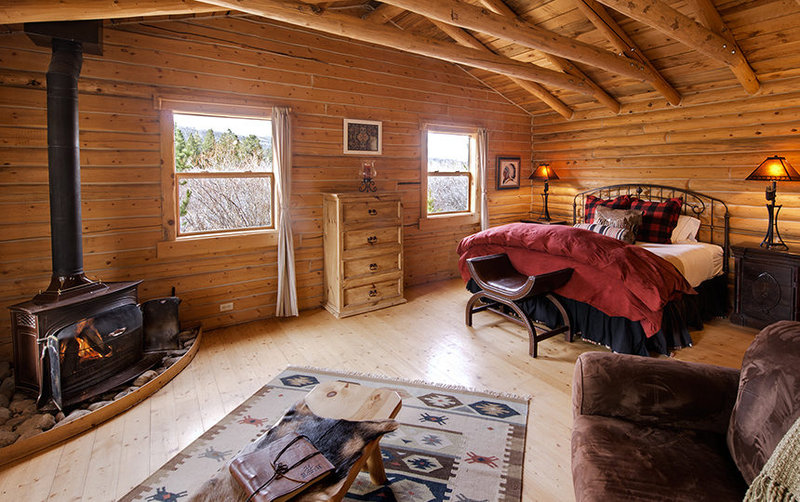
Locate an element on the screen. bed is located at coordinates (668, 272).